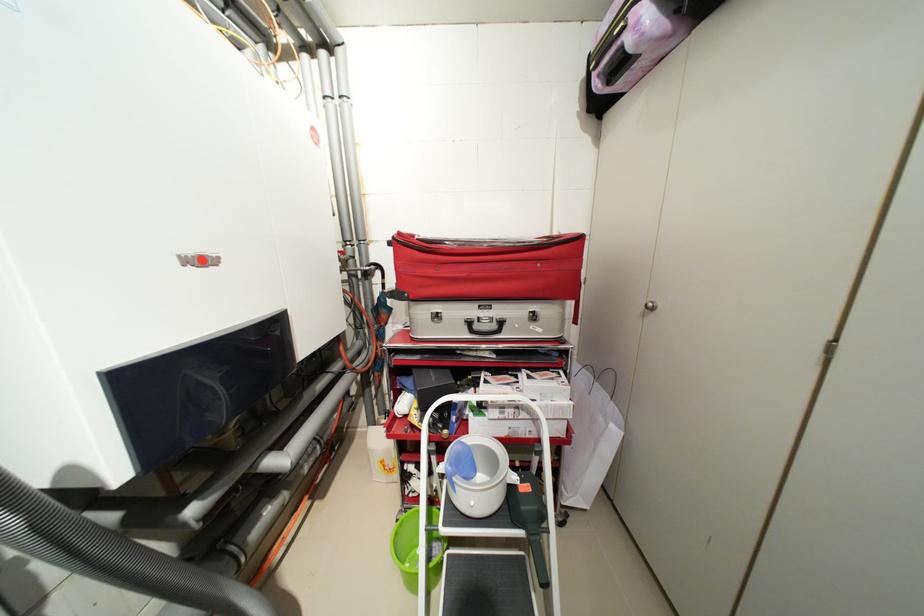
I want to click on white ladder handle, so click(x=488, y=540).